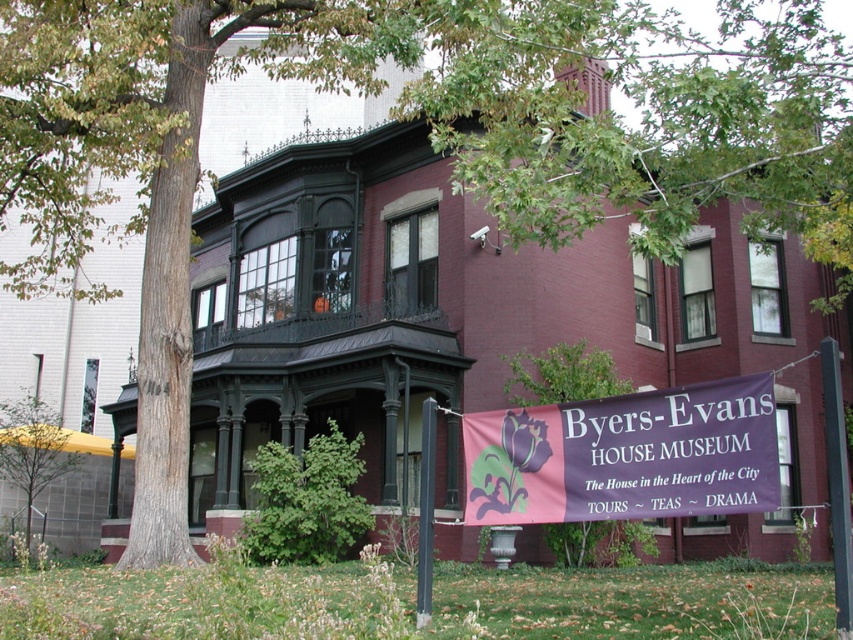
From the picture: You are a visitor standing in front of the Byers Evans House Museum. You see a green leafy tree at center and a black wrought iron porch at upper center. Which object is positioned higher up in the image?

The black wrought iron porch at upper center is positioned higher up in the image than the green leafy tree at center, as it is located above it.

You are standing in front of the Byers Evans House Museum and want to take a photo of the banner. You notice two points marked on the banner at coordinates point (15, 477) and point (379, 323). Which point is closer to the camera?

Point (15, 477) is further to the camera than point (379, 323). Therefore, point (379, 323) is closer to the camera.